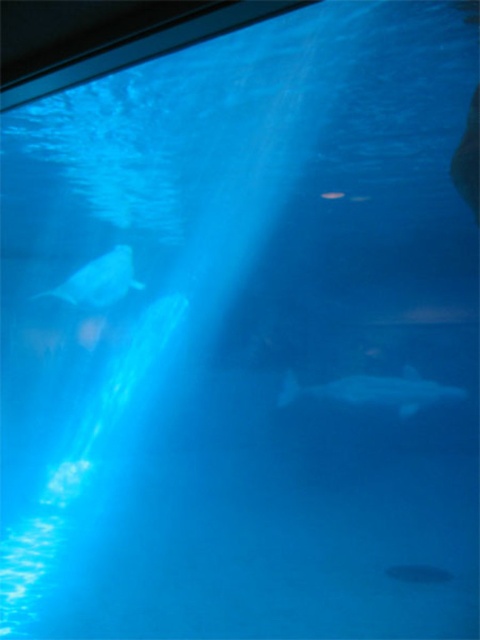
Question: Considering the relative positions of translucent white shark at lower center and white matte whale at upper left in the image provided, where is translucent white shark at lower center located with respect to white matte whale at upper left?

Choices:
 (A) below
 (B) above

Answer: (A)

Question: Where is translucent white shark at lower center located in relation to white matte whale at upper left in the image?

Choices:
 (A) above
 (B) below

Answer: (B)

Question: Is translucent white shark at lower center bigger than white matte whale at upper left?

Choices:
 (A) yes
 (B) no

Answer: (A)

Question: Which point is farther from the camera taking this photo?

Choices:
 (A) (372, 401)
 (B) (75, 285)

Answer: (A)